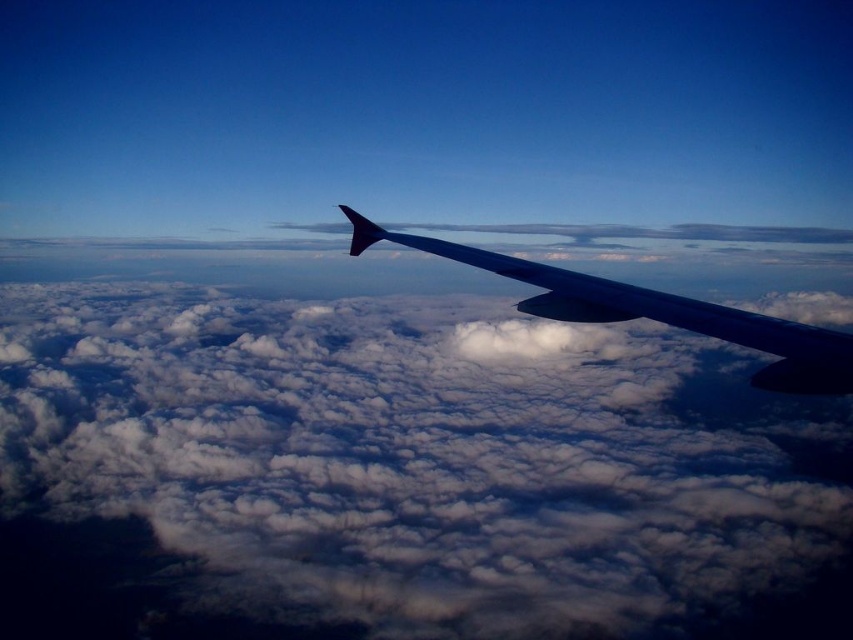
You are a passenger sitting at the window seat and looking out. You see the white fluffy cloud at upper center and the metallic gray wing at center. Which object is closer to you?

The metallic gray wing at center is closer to you than the white fluffy cloud at upper center because the description states that the white fluffy cloud at upper center is further to the viewer than the metallic gray wing at center.

You are a pilot checking the clouds and wings during flight. You need to know if the white fluffy cloud at upper center is wider than the metallic gray wing at center. Can you confirm?

The white fluffy cloud at upper center is wider than the metallic gray wing at center because its width surpasses that of the wing.

You are a passenger sitting by the window and see the white fluffy cloud at upper center and the metallic gray wing at center. Which object is closer to the left side of the window?

The white fluffy cloud at upper center is closer to the left side of the window because it is positioned to the left of the metallic gray wing at center.